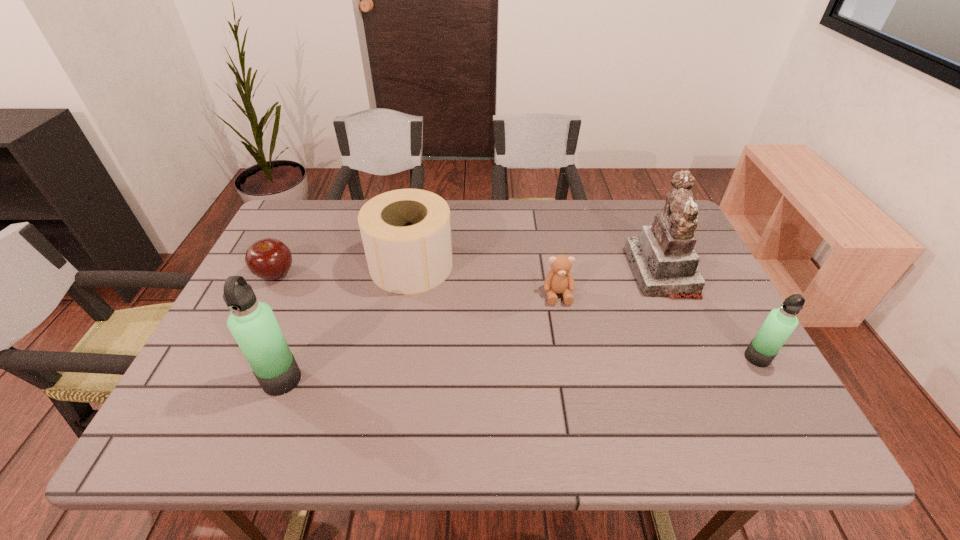
Locate an element on the screen. vacant space that satisfies the following two spatial constraints: 1. on the front-facing side of the shorter thermos bottle; 2. on the left side of the fifth object from left to right is located at coordinates (700, 357).

Locate an element on the screen. The image size is (960, 540). free space that satisfies the following two spatial constraints: 1. on the face of the rightmost object; 2. on the right side of the third object from right to left is located at coordinates (569, 357).

Where is `vacant space that satisfies the following two spatial constraints: 1. on the front-facing side of the fifth object from left to right; 2. on the right side of the right thermos bottle`? vacant space that satisfies the following two spatial constraints: 1. on the front-facing side of the fifth object from left to right; 2. on the right side of the right thermos bottle is located at coordinates (700, 357).